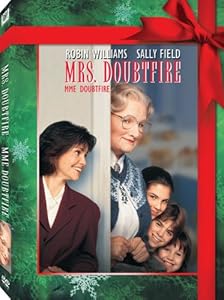
This screenshot has height=300, width=224. Identify the location of vhs. (105, 287).